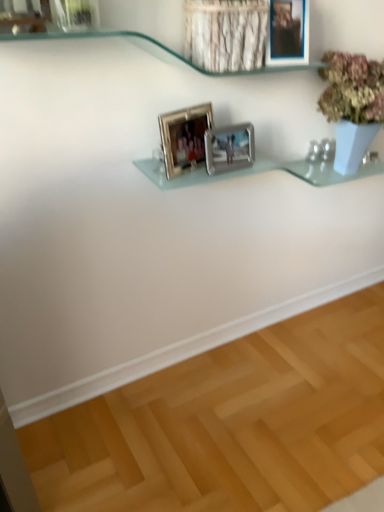
Question: Should I look upward or downward to see silver metallic photo frame at center, positioned as the 1th picture frame in left-to-right order?

Choices:
 (A) down
 (B) up

Answer: (B)

Question: Does metallic silver picture frame at upper center, which ranks as the first picture frame in right-to-left order, have a lesser height compared to clear glass shelf at upper center?

Choices:
 (A) yes
 (B) no

Answer: (B)

Question: Is there a large distance between metallic silver picture frame at upper center, which ranks as the first picture frame in right-to-left order, and clear glass shelf at upper center?

Choices:
 (A) yes
 (B) no

Answer: (B)

Question: From the image's perspective, would you say metallic silver picture frame at upper center, which ranks as the first picture frame in right-to-left order, is positioned over clear glass shelf at upper center?

Choices:
 (A) yes
 (B) no

Answer: (A)

Question: From a real-world perspective, does metallic silver picture frame at upper center, which is counted as the third picture frame, starting from the left, sit lower than clear glass shelf at upper center?

Choices:
 (A) no
 (B) yes

Answer: (A)

Question: Does metallic silver picture frame at upper center, which is counted as the third picture frame, starting from the left, have a smaller size compared to clear glass shelf at upper center?

Choices:
 (A) yes
 (B) no

Answer: (A)

Question: Considering the relative sizes of metallic silver picture frame at upper center, which ranks as the first picture frame in right-to-left order, and clear glass shelf at upper center in the image provided, is metallic silver picture frame at upper center, which ranks as the first picture frame in right-to-left order, wider than clear glass shelf at upper center?

Choices:
 (A) yes
 (B) no

Answer: (B)

Question: From the image's perspective, is silver metallic photo frame at center, marked as the second picture frame in a right-to-left arrangement, below silver metallic photo frame at center, positioned as the 1th picture frame in left-to-right order?

Choices:
 (A) yes
 (B) no

Answer: (A)

Question: Is silver metallic photo frame at center, which appears as the 2th picture frame when viewed from the left, further to camera compared to silver metallic photo frame at center, positioned as the 1th picture frame in left-to-right order?

Choices:
 (A) no
 (B) yes

Answer: (B)

Question: Does silver metallic photo frame at center, which appears as the 2th picture frame when viewed from the left, have a smaller size compared to silver metallic photo frame at center, which appears as the third picture frame when viewed from the right?

Choices:
 (A) yes
 (B) no

Answer: (A)

Question: Considering the relative sizes of silver metallic photo frame at center, marked as the second picture frame in a right-to-left arrangement, and silver metallic photo frame at center, which appears as the third picture frame when viewed from the right, in the image provided, is silver metallic photo frame at center, marked as the second picture frame in a right-to-left arrangement, wider than silver metallic photo frame at center, which appears as the third picture frame when viewed from the right,?

Choices:
 (A) no
 (B) yes

Answer: (A)

Question: Considering the relative sizes of silver metallic photo frame at center, which appears as the 2th picture frame when viewed from the left, and silver metallic photo frame at center, which appears as the third picture frame when viewed from the right, in the image provided, is silver metallic photo frame at center, which appears as the 2th picture frame when viewed from the left, bigger than silver metallic photo frame at center, which appears as the third picture frame when viewed from the right,?

Choices:
 (A) no
 (B) yes

Answer: (A)

Question: Can you confirm if silver metallic photo frame at center, marked as the second picture frame in a right-to-left arrangement, is thinner than silver metallic photo frame at center, which appears as the third picture frame when viewed from the right?

Choices:
 (A) yes
 (B) no

Answer: (A)

Question: Considering the relative sizes of silver metallic photo frame at center, which appears as the third picture frame when viewed from the right, and metallic silver picture frame at upper center, which ranks as the first picture frame in right-to-left order, in the image provided, is silver metallic photo frame at center, which appears as the third picture frame when viewed from the right, bigger than metallic silver picture frame at upper center, which ranks as the first picture frame in right-to-left order,?

Choices:
 (A) no
 (B) yes

Answer: (A)